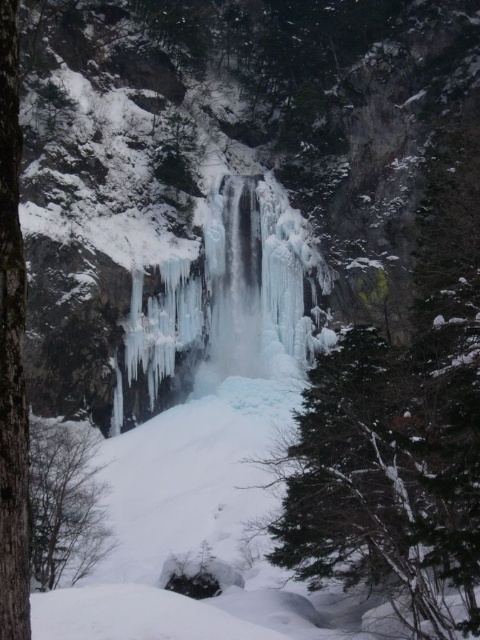
Question: Which point is farther to the camera?

Choices:
 (A) (19, 595)
 (B) (39, 422)

Answer: (B)

Question: Does icy white waterfall at center appear on the right side of brown wood tree at lower left?

Choices:
 (A) yes
 (B) no

Answer: (A)

Question: Does green textured tree at center appear on the left side of barky brown tree trunk at left?

Choices:
 (A) no
 (B) yes

Answer: (A)

Question: Is green textured tree at center to the right of brown wood tree at lower left from the viewer's perspective?

Choices:
 (A) no
 (B) yes

Answer: (B)

Question: Which point appears closest to the camera in this image?

Choices:
 (A) (324, 525)
 (B) (36, 508)
 (C) (252, 282)

Answer: (A)

Question: Which point is farther to the camera?

Choices:
 (A) green textured tree at center
 (B) brown wood tree at lower left

Answer: (A)